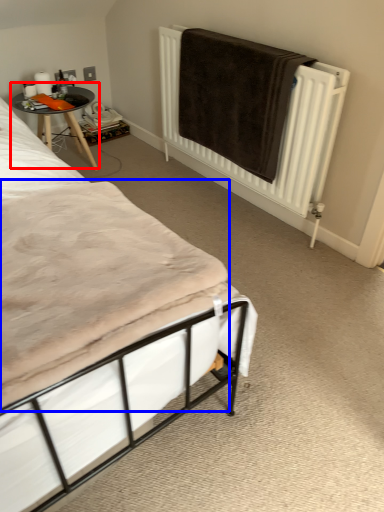
Question: Which point is closer to the camera, table (highlighted by a red box) or mattress (highlighted by a blue box)?

Choices:
 (A) table
 (B) mattress

Answer: (B)